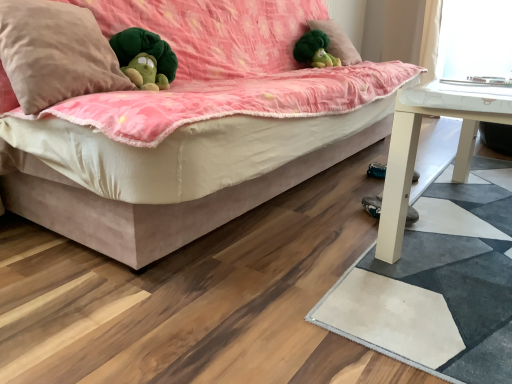
What is the approximate width of white matte table at lower right?

It is 38.16 inches.

Measure the distance between point [500,90] and camera.

They are 3.32 feet apart.

Where is `suede-like beige studio couch at center`? The image size is (512, 384). suede-like beige studio couch at center is located at coordinates (173, 166).

The image size is (512, 384). What do you see at coordinates (55, 53) in the screenshot? I see `beige soft pillow at upper left, arranged as the second pillow when viewed from the back` at bounding box center [55, 53].

What do you see at coordinates (439, 284) in the screenshot? I see `white matte mat at lower right` at bounding box center [439, 284].

Identify the location of white matte table at lower right. (417, 145).

From the picture: Is black suede shoe at lower right wider or thinner than green plush toy at upper center?

black suede shoe at lower right is thinner than green plush toy at upper center.

Which is closer, (x=373, y=198) or (x=314, y=48)?

Point (x=373, y=198).

From the image's perspective, which one is positioned lower, black suede shoe at lower right or green plush toy at upper center?

black suede shoe at lower right.

Considering the relative positions of black suede shoe at lower right and green plush toy at upper center in the image provided, is black suede shoe at lower right to the left of green plush toy at upper center from the viewer's perspective?

No, black suede shoe at lower right is not to the left of green plush toy at upper center.

Could you tell me if beige soft pillow at upper left, the 2th pillow in the top-to-bottom sequence, is facing white matte table at lower right?

No.

From the image's perspective, does beige soft pillow at upper left, arranged as the second pillow when viewed from the back, appear higher than white matte table at lower right?

Yes, from the image's perspective, beige soft pillow at upper left, arranged as the second pillow when viewed from the back, is above white matte table at lower right.

Can you see beige soft pillow at upper left, which is the 1th pillow from front to back, touching white matte table at lower right?

beige soft pillow at upper left, which is the 1th pillow from front to back, and white matte table at lower right are clearly separated.

Considering the relative positions of beige soft pillow at upper left, the 2th pillow in the top-to-bottom sequence, and white matte table at lower right in the image provided, is beige soft pillow at upper left, the 2th pillow in the top-to-bottom sequence, to the right of white matte table at lower right from the viewer's perspective?

Incorrect, beige soft pillow at upper left, the 2th pillow in the top-to-bottom sequence, is not on the right side of white matte table at lower right.

Between suede-like beige studio couch at center and green plush toy at upper center, which one is positioned behind?

Positioned behind is green plush toy at upper center.

In terms of size, does suede-like beige studio couch at center appear bigger or smaller than green plush toy at upper center?

Clearly, suede-like beige studio couch at center is larger in size than green plush toy at upper center.

Looking at their sizes, would you say suede-like beige studio couch at center is wider or thinner than green plush toy at upper center?

suede-like beige studio couch at center is wider than green plush toy at upper center.

Do you think suede-like beige studio couch at center is within green plush toy at upper center, or outside of it?

suede-like beige studio couch at center is located beyond the bounds of green plush toy at upper center.

Based on the photo, in terms of size, does white matte table at lower right appear bigger or smaller than green plush toy at upper center?

Clearly, white matte table at lower right is larger in size than green plush toy at upper center.

Between white matte table at lower right and green plush toy at upper center, which one has less height?

green plush toy at upper center.

Which of these two, suede-like beige studio couch at center or green plush at upper center, the first pillow positioned from the back, is wider?

With larger width is suede-like beige studio couch at center.

From a real-world perspective, relative to green plush at upper center, the first pillow positioned from the back, is suede-like beige studio couch at center vertically above or below?

From a real-world perspective, suede-like beige studio couch at center is physically below green plush at upper center, the first pillow positioned from the back.

I want to click on pillow on the right of suede-like beige studio couch at center, so click(x=337, y=41).

Is suede-like beige studio couch at center surrounding green plush at upper center, the first pillow positioned from the back?

That's correct, green plush at upper center, the first pillow positioned from the back, is inside suede-like beige studio couch at center.

Is white matte table at lower right positioned with its back to green plush at upper center, the 1th pillow from the right?

That's not correct — white matte table at lower right is not looking away from green plush at upper center, the 1th pillow from the right.

Who is more distant, white matte table at lower right or green plush at upper center, the 1th pillow from the right?

green plush at upper center, the 1th pillow from the right, is behind.

From the image's perspective, is white matte table at lower right located above or below green plush at upper center, which appears as the second pillow when ordered from the bottom?

Based on their image positions, white matte table at lower right is located beneath green plush at upper center, which appears as the second pillow when ordered from the bottom.

Which is behind, point (403, 123) or point (326, 20)?

The point (326, 20) is more distant.

From a real-world perspective, is black suede shoe at lower right over suede-like beige studio couch at center?

Actually, black suede shoe at lower right is physically below suede-like beige studio couch at center in the real world.

Considering the relative sizes of black suede shoe at lower right and suede-like beige studio couch at center in the image provided, is black suede shoe at lower right shorter than suede-like beige studio couch at center?

Correct, black suede shoe at lower right is not as tall as suede-like beige studio couch at center.

Where is `footwear located underneath the suede-like beige studio couch at center (from a real-world perspective)`? footwear located underneath the suede-like beige studio couch at center (from a real-world perspective) is located at coordinates (372, 205).

Is black suede shoe at lower right situated inside suede-like beige studio couch at center or outside?

black suede shoe at lower right is located beyond the bounds of suede-like beige studio couch at center.

In the image, there is a green plush toy at upper center. Where is `footwear below it (from a real-world perspective)`? footwear below it (from a real-world perspective) is located at coordinates (372, 205).

This screenshot has height=384, width=512. There is a white matte table at lower right. In order to click on the 1st pillow above it (from a real-world perspective) in this screenshot , I will do `click(55, 53)`.

From the image, which object appears to be nearer to green plush at upper center, which appears as the second pillow when ordered from the bottom, white matte mat at lower right or green plush toy at upper center?

Based on the image, green plush toy at upper center appears to be nearer to green plush at upper center, which appears as the second pillow when ordered from the bottom.

Which object lies further to the anchor point white matte table at lower right, green plush toy at upper center or beige soft pillow at upper left, the 1th pillow when ordered from left to right?

green plush toy at upper center lies further to white matte table at lower right than the other object.

From the image, which object appears to be farther from suede-like beige studio couch at center, green plush toy at upper center or white matte mat at lower right?

green plush toy at upper center.

Based on their spatial positions, is green plush at upper center, which appears as the second pillow when ordered from the bottom, or green plush toy at upper center closer to white matte table at lower right?

The object closer to white matte table at lower right is green plush toy at upper center.

Looking at the image, which one is located further to beige soft pillow at upper left, which is counted as the second pillow, starting from the right, suede-like beige studio couch at center or white matte mat at lower right?

white matte mat at lower right is further to beige soft pillow at upper left, which is counted as the second pillow, starting from the right.

Considering their positions, is black suede shoe at lower right positioned further to green plush at upper center, arranged as the 2th pillow when viewed from the left, than white matte mat at lower right?

white matte mat at lower right is positioned further to the anchor green plush at upper center, arranged as the 2th pillow when viewed from the left.

Based on their spatial positions, is black suede shoe at lower right or white matte mat at lower right closer to white matte table at lower right?

white matte mat at lower right.

Estimate the real-world distances between objects in this image. Which object is further from white matte mat at lower right, green plush at upper center, the 1th pillow from the right, or green plush toy at upper center?

Among the two, green plush at upper center, the 1th pillow from the right, is located further to white matte mat at lower right.

At what (x,y) coordinates should I click in order to perform the action: click on table located between white matte mat at lower right and black suede shoe at lower right in the depth direction. Please return your answer as a coordinate pair (x, y). The width and height of the screenshot is (512, 384). Looking at the image, I should click on (417, 145).

In order to click on mat positioned between suede-like beige studio couch at center and black suede shoe at lower right from near to far in this screenshot , I will do (x=439, y=284).

Identify the location of doll between beige soft pillow at upper left, the 2th pillow in the top-to-bottom sequence, and green plush at upper center, the second pillow in the front-to-back sequence, along the z-axis. The image size is (512, 384). (315, 50).

Where is `pillow between suede-like beige studio couch at center and green plush toy at upper center in the front-back direction`? The width and height of the screenshot is (512, 384). pillow between suede-like beige studio couch at center and green plush toy at upper center in the front-back direction is located at coordinates (55, 53).